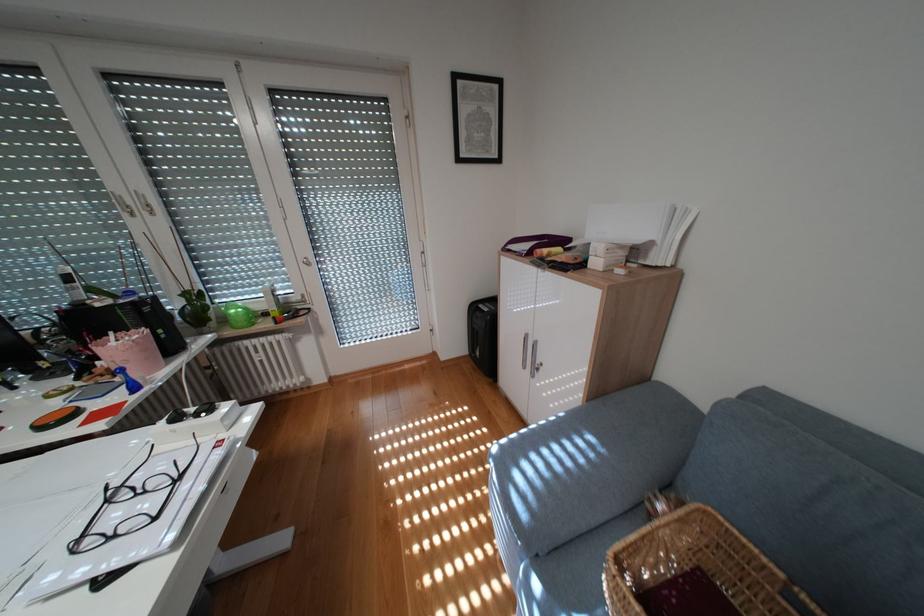
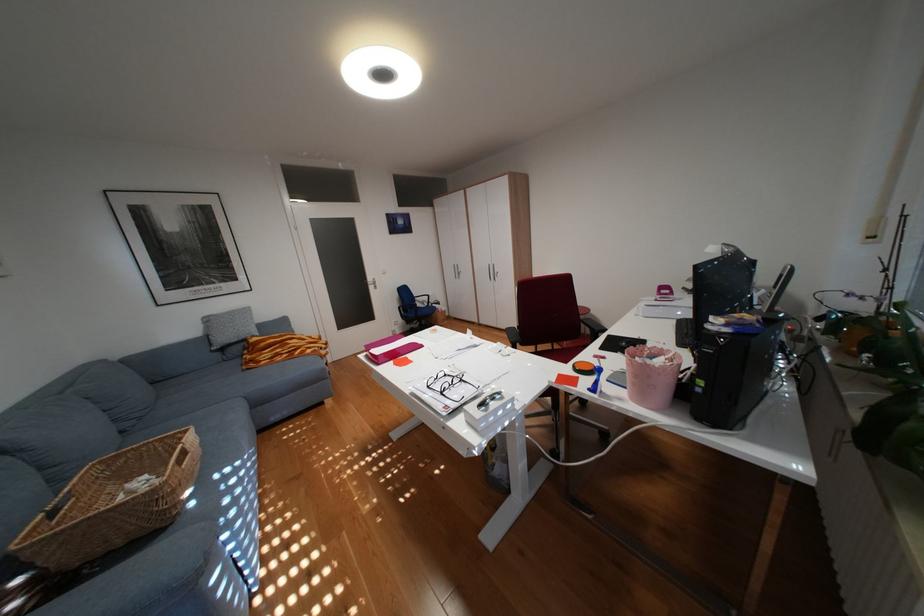
In the second image, find the point that corresponds to (x=236, y=436) in the first image.

(473, 416)